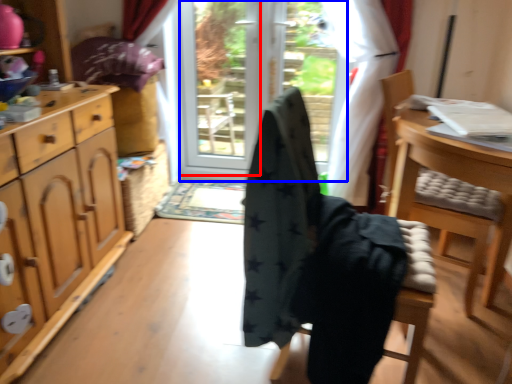
Question: Which of the following is the farthest to the observer, screen door (highlighted by a red box) or screen door (highlighted by a blue box)?

Choices:
 (A) screen door
 (B) screen door

Answer: (A)